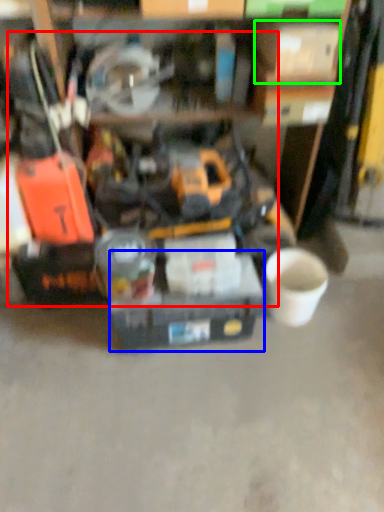
Question: Which object is the farthest from tool (highlighted by a red box)? Choose among these: box (highlighted by a blue box) or box (highlighted by a green box).

Choices:
 (A) box
 (B) box

Answer: (B)